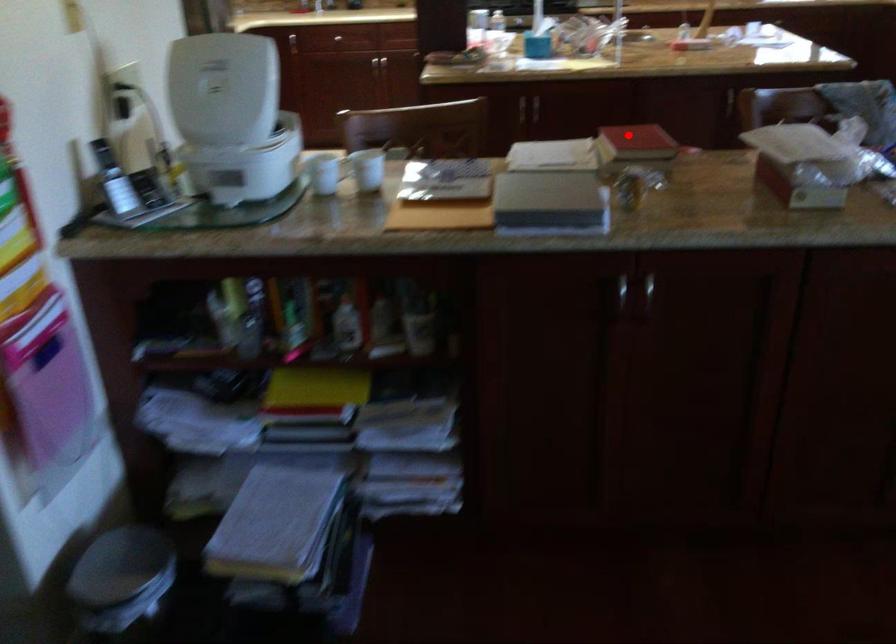
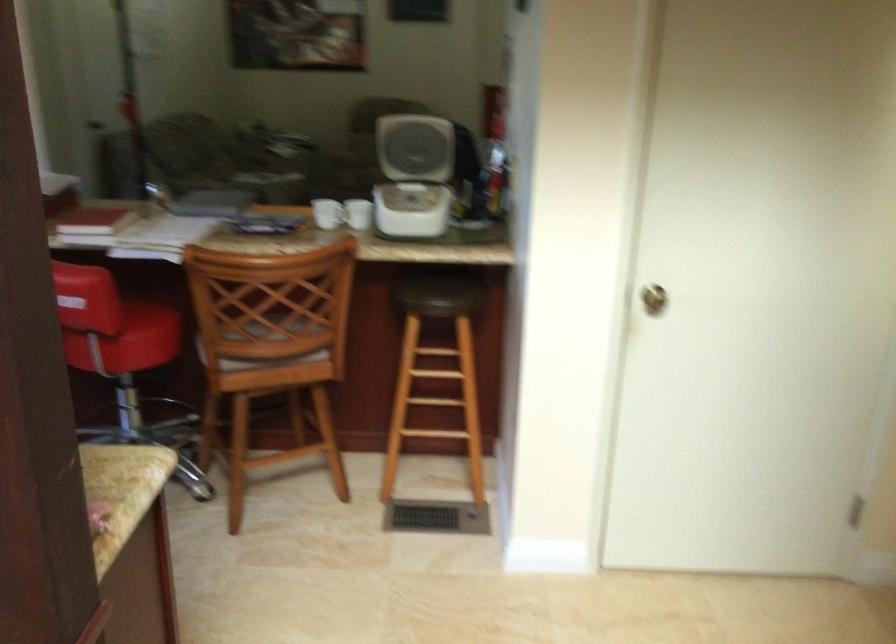
Question: I am providing you with two images of the same scene from different viewpoints. Given a red point in image1, look at the same physical point in image2. Is it:

Choices:
 (A) Closer to the viewpoint
 (B) Farther from the viewpoint

Answer: (B)